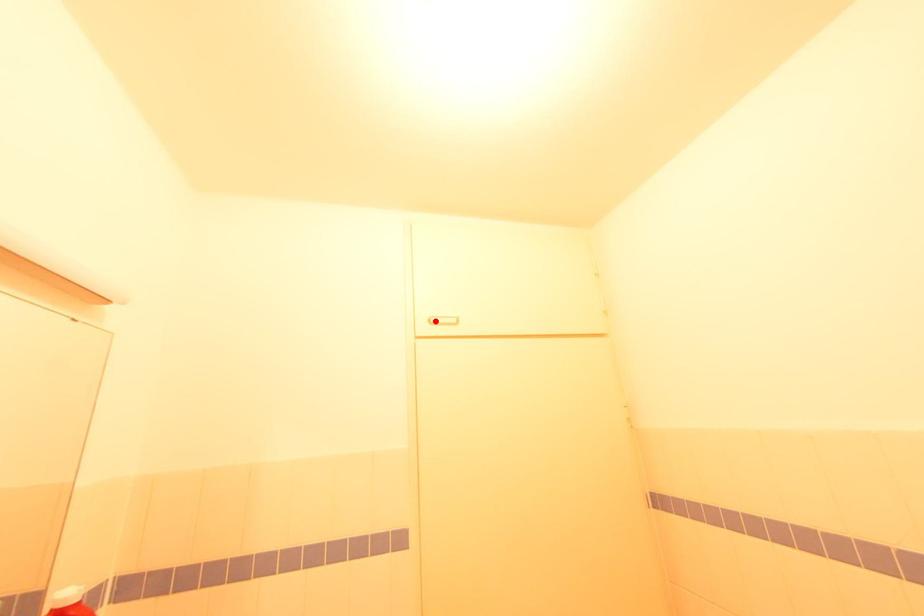
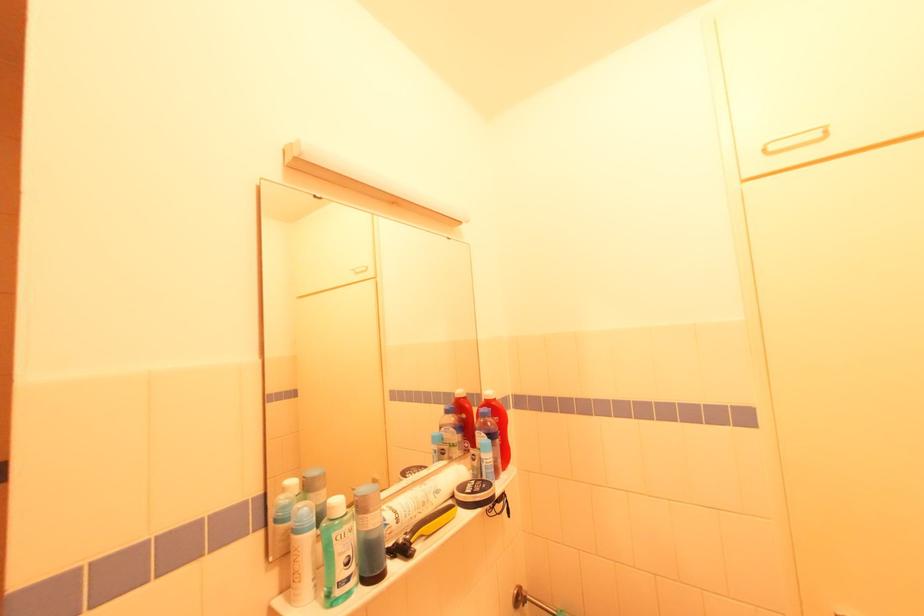
Locate, in the second image, the point that corresponds to the highlighted location in the first image.

(773, 148)